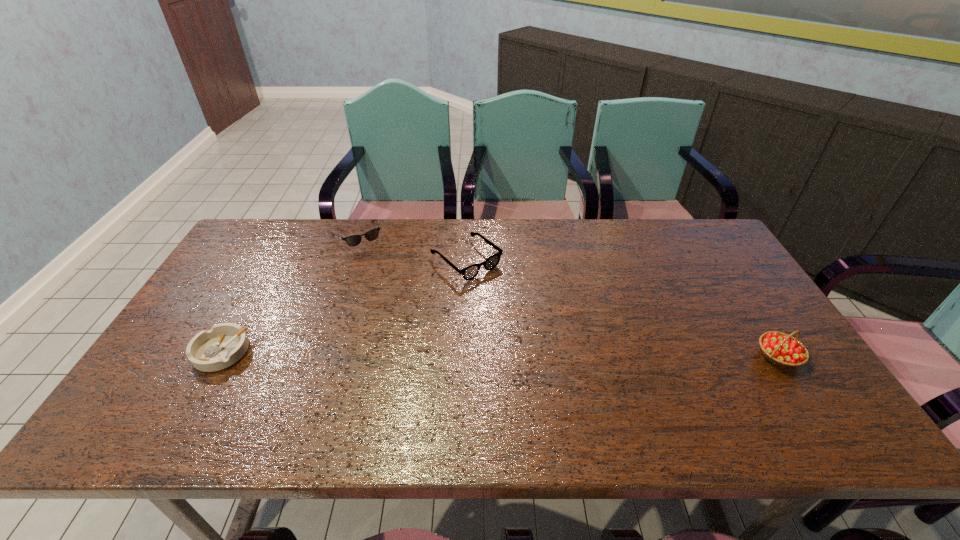
Where is `blank space located 0.180m on the arms of the spectacles`? The width and height of the screenshot is (960, 540). blank space located 0.180m on the arms of the spectacles is located at coordinates (528, 314).

Find the location of a particular element. This screenshot has width=960, height=540. free space located 0.090m on the front-facing side of the third object from right to left is located at coordinates (375, 265).

In order to click on vacant space located on the front-facing side of the third object from right to left in this screenshot , I will do 401,305.

Where is `vacant area located on the front-facing side of the third object from right to left`? The width and height of the screenshot is (960, 540). vacant area located on the front-facing side of the third object from right to left is located at coordinates (404, 309).

You are a GUI agent. You are given a task and a screenshot of the screen. Output one action in this format:
    pyautogui.click(x=<x>, y=<y>)
    Task: Click on the spectacles at the far edge
    
    Given the screenshot: What is the action you would take?
    pyautogui.click(x=470, y=272)

I want to click on sunglasses situated at the far edge, so click(x=354, y=240).

You are a GUI agent. You are given a task and a screenshot of the screen. Output one action in this format:
    pyautogui.click(x=<x>, y=<y>)
    Task: Click on the ashtray that is positioned at the near edge
    
    Given the screenshot: What is the action you would take?
    pyautogui.click(x=223, y=345)

Locate an element on the screen. Image resolution: width=960 pixels, height=540 pixels. strawberry located in the near edge section of the desktop is located at coordinates (782, 349).

I want to click on object that is positioned at the left edge, so click(x=223, y=345).

Identify the location of object that is at the right edge. 782,349.